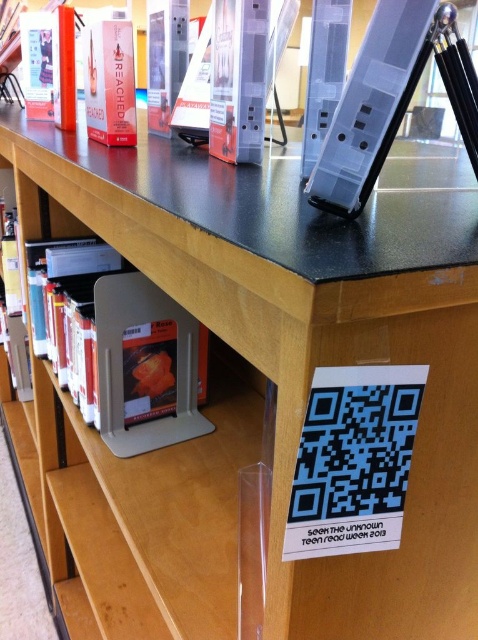
You are standing in front of the library display shelf for Teen Read Week. There are two points marked on the shelf. The first point is at coordinate (x=358, y=195) and the second is at (x=105, y=96). Which point is closer to your eyes?

Point (x=358, y=195) is closer to your eyes because it is closer to the camera than point (x=105, y=96).

You are a librarian organizing the Teen Read Week display. You have a matte plastic tablet at upper right and a matte red book at upper left on the shelf. Which item takes up more space on the shelf?

The matte red book at upper left takes up more space on the shelf because it is larger than the matte plastic tablet at upper right.

You are a librarian who needs to place a new book on the shelf. The book requires a space that is at least 34 inches away from the camera to ensure visibility. Is the orange matte book at center positioned far enough to meet this requirement?

The orange matte book at center is positioned 33.99 inches from the camera, which is just shy of the required 34 inches. Therefore, it does not meet the visibility requirement.